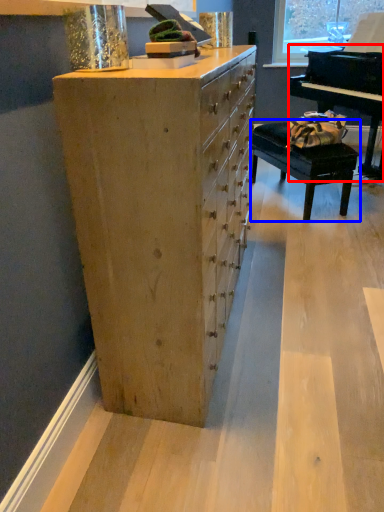
Question: Which object is further to the camera taking this photo, piano (highlighted by a red box) or table (highlighted by a blue box)?

Choices:
 (A) piano
 (B) table

Answer: (B)